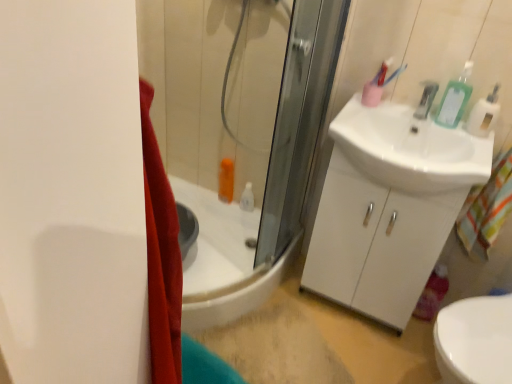
Locate an element on the screen. vacant space in front of green plastic bottle at upper right is located at coordinates (465, 140).